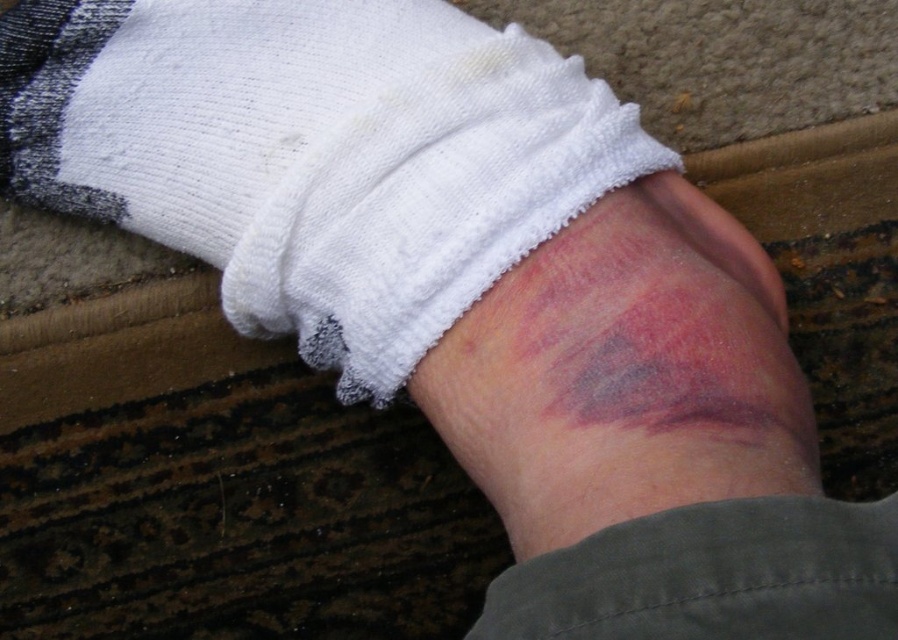
You are a photographer setting up a shot of the white terry cloth sock at center. You need to position the camera so that it is exactly 1 meter away from the sock. Based on the current setup, is the camera already at the correct distance?

The distance of white terry cloth sock at center from camera is 91.96 centimeters. Since 91.96 cm is less than 1 meter, the camera is too close and needs to be moved back approximately 8.04 centimeters to reach the desired 1 meter distance.

You are a nurse examining a patient. You notice the white terry cloth sock at center and the purple bruised skin at center. Which object is wider?

The white terry cloth sock at center is wider than the purple bruised skin at center according to the description.